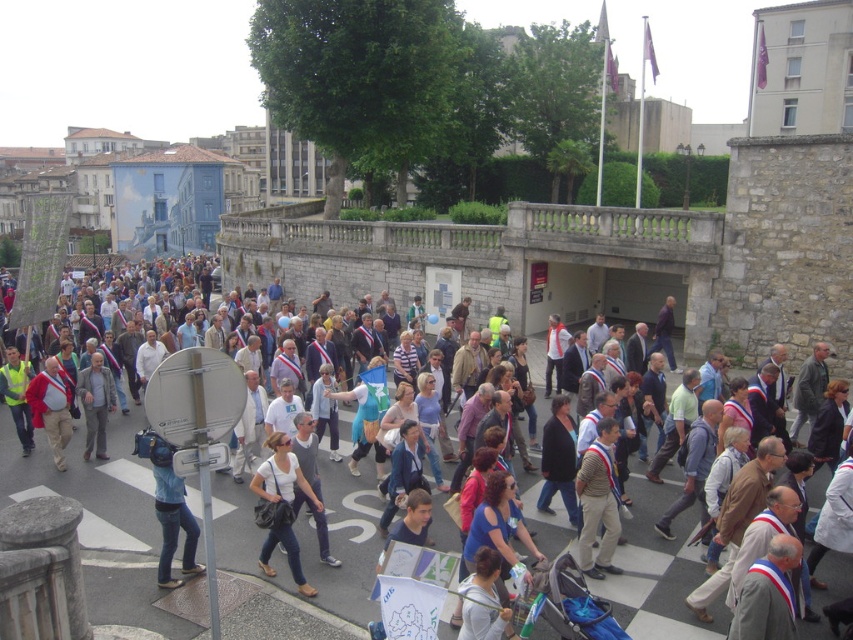
From the picture: You are a photographer standing at the starting point of the protest route. You want to capture a close shot of the white cotton shirt at center. Given that your camera can focus clearly up to 50 feet, will you be able to take a clear photo without moving closer?

The white cotton shirt at center is 75.43 feet away from the viewer. Since the camera can only focus clearly up to 50 feet, you will not be able to take a clear photo without moving closer.